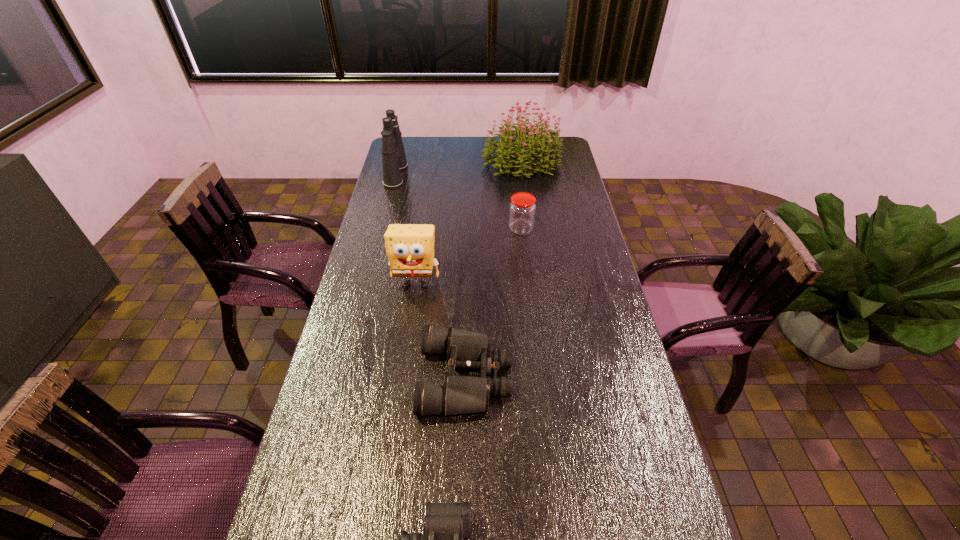
Find the location of `vacant region at the right edge of the desktop`. vacant region at the right edge of the desktop is located at coordinates (586, 273).

Where is `blank region between the second nearest object and the bouquet`? blank region between the second nearest object and the bouquet is located at coordinates (493, 269).

At what (x,y) coordinates should I click in order to perform the action: click on free spot between the sponge and the bouquet. Please return your answer as a coordinate pair (x, y). This screenshot has height=540, width=960. Looking at the image, I should click on (468, 222).

Identify the location of unoccupied area between the bouquet and the third nearest object. This screenshot has height=540, width=960. (468, 222).

This screenshot has height=540, width=960. What are the coordinates of `vacant area that lies between the bouquet and the fifth farthest object` in the screenshot? It's located at (493, 269).

Identify the location of the fourth closest object to the nearest object. (394, 160).

Where is `object that can be found as the fourth closest to the leftmost object`? object that can be found as the fourth closest to the leftmost object is located at coordinates (460, 394).

This screenshot has width=960, height=540. Find the location of `binoculars that can be found as the second closest to the leftmost object`. binoculars that can be found as the second closest to the leftmost object is located at coordinates (446, 524).

Find the location of a particular element. Image resolution: width=960 pixels, height=540 pixels. binoculars that stands as the second closest to the bouquet is located at coordinates (460, 394).

This screenshot has height=540, width=960. In order to click on vacant space that satisfies the following two spatial constraints: 1. on the back side of the bouquet; 2. on the left side of the third farthest object in this screenshot , I will do `click(514, 162)`.